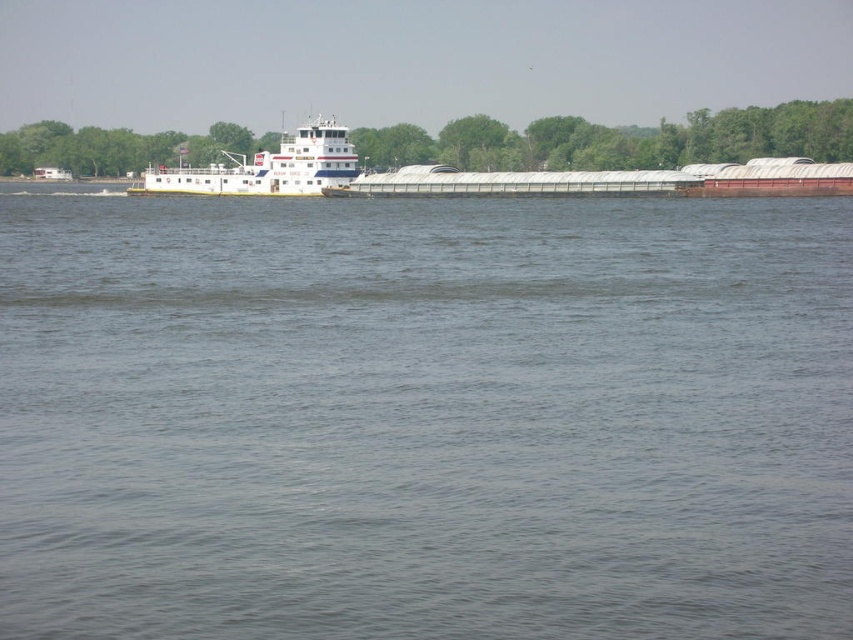
Is the position of gray matte water at center more distant than that of white glossy barge at center?

That is False.

Locate an element on the screen. This screenshot has width=853, height=640. gray matte water at center is located at coordinates (424, 417).

This screenshot has width=853, height=640. Identify the location of gray matte water at center. (424, 417).